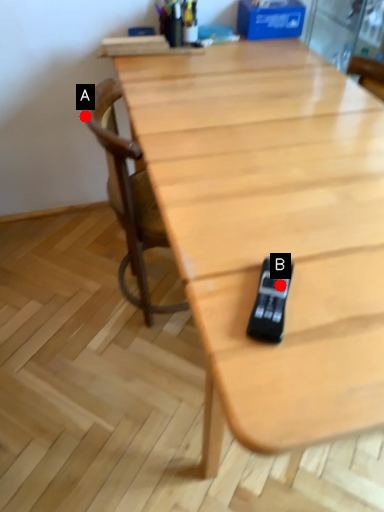
Question: Two points are circled on the image, labeled by A and B beside each circle. Which point is further to the camera?

Choices:
 (A) A is further
 (B) B is further

Answer: (A)